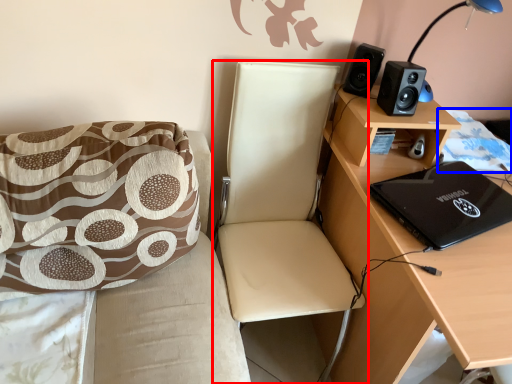
Question: Which point is further to the camera, chair (highlighted by a red box) or quilt (highlighted by a blue box)?

Choices:
 (A) chair
 (B) quilt

Answer: (B)